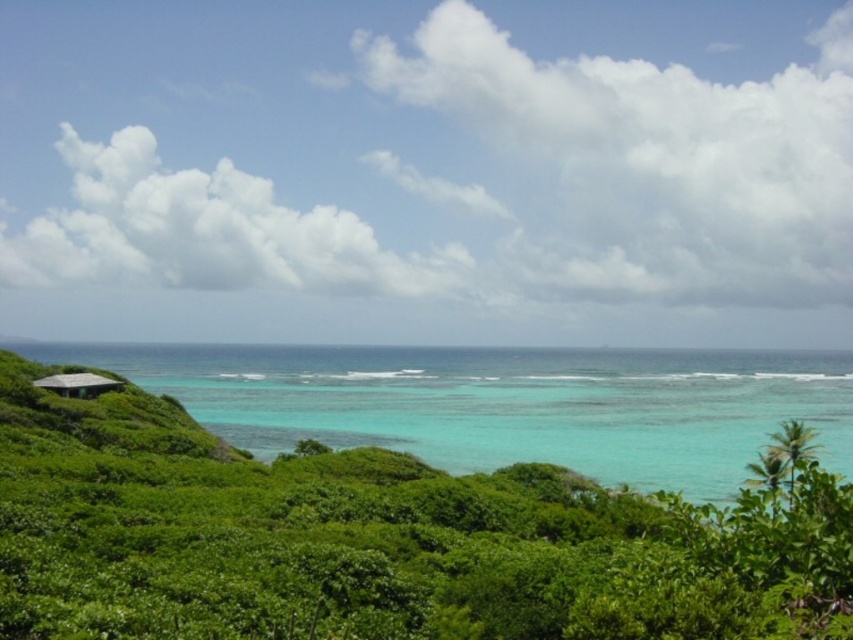
Question: Among these objects, which one is nearest to the camera?

Choices:
 (A) gray concrete hut at lower left
 (B) clear blue water at left

Answer: (B)

Question: Is clear blue water at left positioned at the back of gray concrete hut at lower left?

Choices:
 (A) no
 (B) yes

Answer: (A)

Question: Does clear blue water at left have a greater width compared to gray concrete hut at lower left?

Choices:
 (A) no
 (B) yes

Answer: (B)

Question: Observing the image, what is the correct spatial positioning of clear blue water at left in reference to gray concrete hut at lower left?

Choices:
 (A) right
 (B) left

Answer: (A)